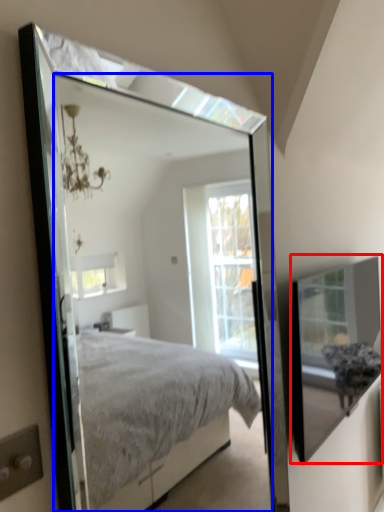
Question: Among these objects, which one is nearest to the camera, glass box (highlighted by a red box) or mirror (highlighted by a blue box)?

Choices:
 (A) glass box
 (B) mirror

Answer: (B)